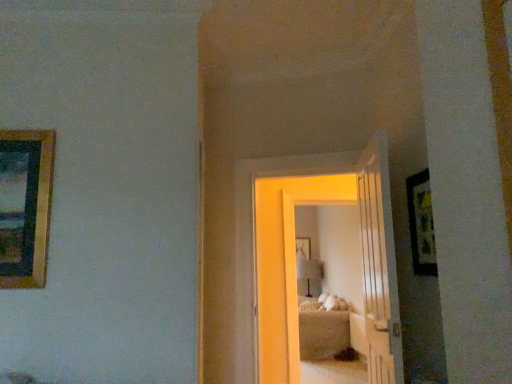
Question: Can you confirm if beige fabric bed at center is smaller than white wooden door at center, arranged as the first door when viewed from the right?

Choices:
 (A) yes
 (B) no

Answer: (B)

Question: Is beige fabric bed at center bigger than white wooden door at center, arranged as the first door when viewed from the right?

Choices:
 (A) yes
 (B) no

Answer: (A)

Question: From the image's perspective, is beige fabric bed at center under white wooden door at center, arranged as the first door when viewed from the right?

Choices:
 (A) no
 (B) yes

Answer: (B)

Question: Is beige fabric bed at center at the right side of white wooden door at center, arranged as the first door when viewed from the right?

Choices:
 (A) yes
 (B) no

Answer: (A)

Question: Is beige fabric bed at center oriented away from white wooden door at center, the 2th door positioned from the left?

Choices:
 (A) yes
 (B) no

Answer: (B)

Question: From a real-world perspective, is beige fabric bed at center over white wooden door at center, arranged as the first door when viewed from the right?

Choices:
 (A) no
 (B) yes

Answer: (A)

Question: Is the surface of matte white lamp at center in direct contact with gold-framed picture at left, the third picture frame when ordered from bottom to top?

Choices:
 (A) yes
 (B) no

Answer: (B)

Question: Is matte white lamp at center oriented away from gold-framed picture at left, the third picture frame when ordered from bottom to top?

Choices:
 (A) no
 (B) yes

Answer: (A)

Question: Considering the relative positions of matte white lamp at center and gold-framed picture at left, which is the 1th picture frame from top to bottom, in the image provided, is matte white lamp at center to the right of gold-framed picture at left, which is the 1th picture frame from top to bottom, from the viewer's perspective?

Choices:
 (A) no
 (B) yes

Answer: (B)

Question: Can you confirm if matte white lamp at center is thinner than gold-framed picture at left, placed as the second picture frame when sorted from back to front?

Choices:
 (A) yes
 (B) no

Answer: (B)

Question: From a real-world perspective, is matte white lamp at center positioned over gold-framed picture at left, the third picture frame when ordered from bottom to top, based on gravity?

Choices:
 (A) no
 (B) yes

Answer: (A)

Question: Considering the relative sizes of matte white lamp at center and gold-framed picture at left, placed as the second picture frame when sorted from back to front, in the image provided, is matte white lamp at center smaller than gold-framed picture at left, placed as the second picture frame when sorted from back to front,?

Choices:
 (A) yes
 (B) no

Answer: (B)

Question: Is wooden picture frame at center, acting as the 3th picture frame starting from the front, completely or partially outside of wooden framed picture at right, which ranks as the second picture frame in bottom-to-top order?

Choices:
 (A) yes
 (B) no

Answer: (A)